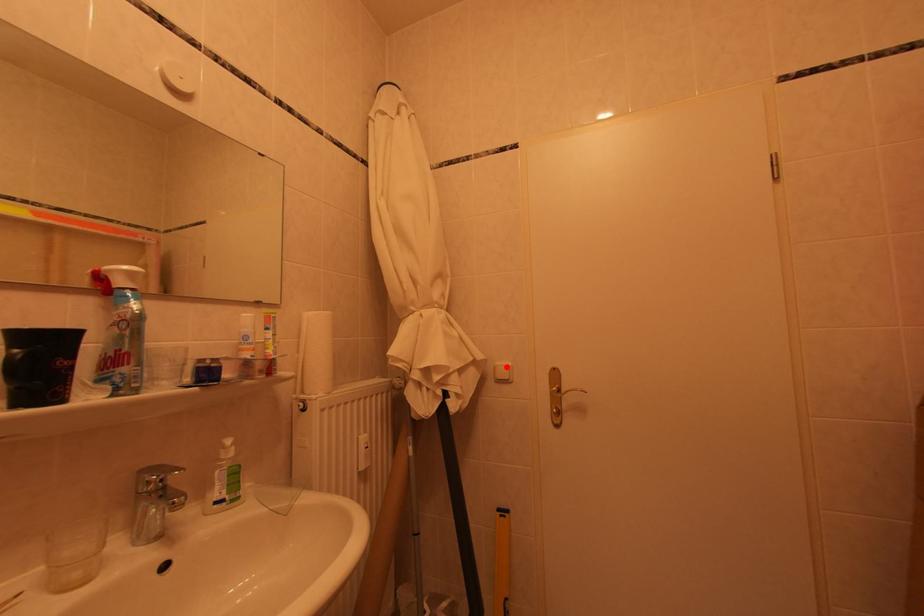
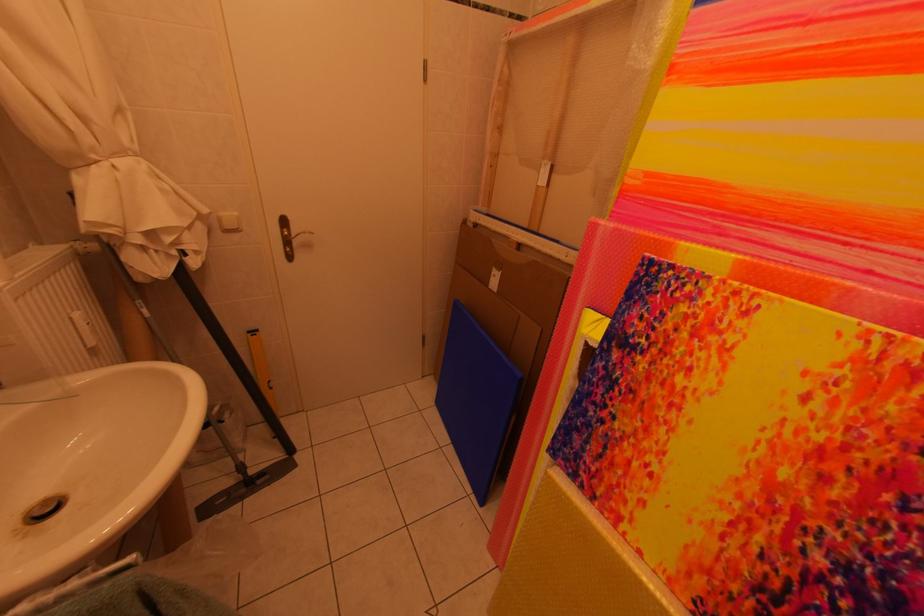
Where in the second image is the point corresponding to the highlighted location from the first image?

(229, 217)